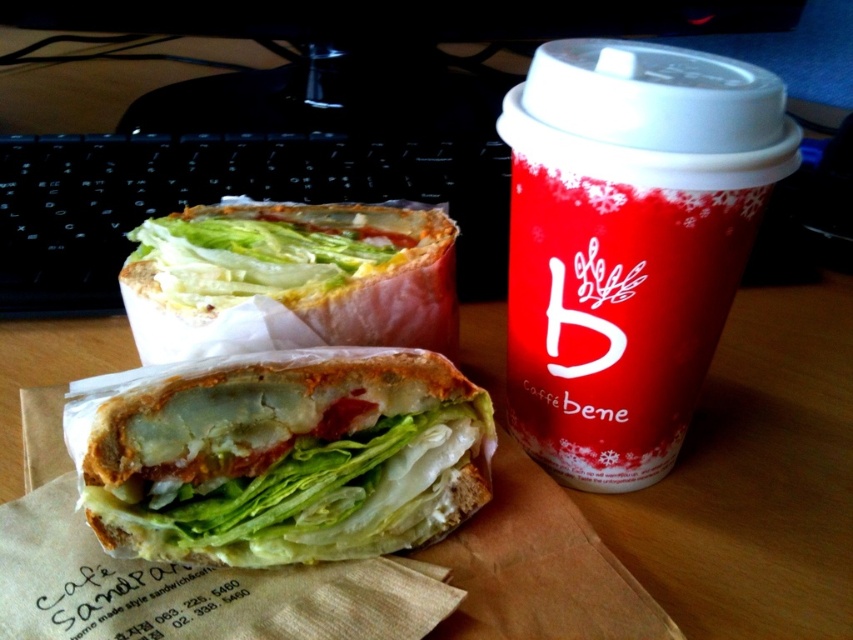
Who is lower down, red paper cup at upper right or matte white sandwich at center?

Positioned lower is matte white sandwich at center.

Who is positioned more to the right, red paper cup at upper right or matte white sandwich at center?

From the viewer's perspective, red paper cup at upper right appears more on the right side.

You are a GUI agent. You are given a task and a screenshot of the screen. Output one action in this format:
    pyautogui.click(x=<x>, y=<y>)
    Task: Click on the red paper cup at upper right
    This screenshot has height=640, width=853.
    Given the screenshot: What is the action you would take?
    pyautogui.click(x=628, y=243)

The image size is (853, 640). What are the coordinates of `red paper cup at upper right` in the screenshot? It's located at (628, 243).

Does point (384, 426) lie behind point (352, 252)?

No, (384, 426) is closer to viewer.

Can you confirm if matte white sandwich at center is positioned to the right of matte white bread at center?

Yes, matte white sandwich at center is to the right of matte white bread at center.

Is point (136, 445) farther from viewer compared to point (334, 211)?

No.

This screenshot has height=640, width=853. I want to click on matte white sandwich at center, so click(x=280, y=456).

Which is behind, point (527, 308) or point (228, 291)?

The point (228, 291) is more distant.

Find the location of a particular element. The height and width of the screenshot is (640, 853). red paper cup at upper right is located at coordinates (628, 243).